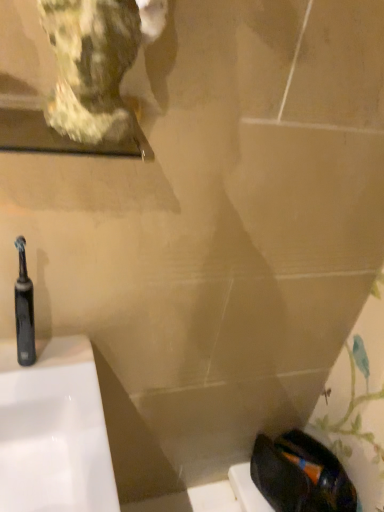
Image resolution: width=384 pixels, height=512 pixels. What do you see at coordinates (96, 62) in the screenshot?
I see `marble statue at upper left` at bounding box center [96, 62].

The height and width of the screenshot is (512, 384). In order to click on marble statue at upper left in this screenshot , I will do `click(96, 62)`.

The width and height of the screenshot is (384, 512). What do you see at coordinates (24, 310) in the screenshot?
I see `black rubber toothbrush at left` at bounding box center [24, 310].

This screenshot has height=512, width=384. Identify the location of black rubber toothbrush at left. (24, 310).

Measure the distance between black rubber toothbrush at left and camera.

24.82 inches.

I want to click on marble statue at upper left, so click(x=96, y=62).

Between marble statue at upper left and black rubber toothbrush at left, which one appears on the left side from the viewer's perspective?

black rubber toothbrush at left.

Who is more distant, marble statue at upper left or black rubber toothbrush at left?

black rubber toothbrush at left is further from the camera.

Between point (103, 98) and point (16, 286), which one is positioned behind?

Point (16, 286)

From the image's perspective, which one is positioned lower, marble statue at upper left or black rubber toothbrush at left?

black rubber toothbrush at left.

Based on the photo, from a real-world perspective, is marble statue at upper left physically located above or below black rubber toothbrush at left?

From a real-world perspective, marble statue at upper left is physically above black rubber toothbrush at left.

Considering the sizes of objects marble statue at upper left and black rubber toothbrush at left in the image provided, who is wider, marble statue at upper left or black rubber toothbrush at left?

With larger width is marble statue at upper left.

In terms of height, does marble statue at upper left look taller or shorter compared to black rubber toothbrush at left?

In the image, marble statue at upper left appears to be shorter than black rubber toothbrush at left.

Between marble statue at upper left and black rubber toothbrush at left, which one has larger size?

With larger size is marble statue at upper left.

Is marble statue at upper left not within black rubber toothbrush at left?

Yes, marble statue at upper left is not within black rubber toothbrush at left.

In the scene shown: Can you see marble statue at upper left touching black rubber toothbrush at left?

No, marble statue at upper left is not touching black rubber toothbrush at left.

Is marble statue at upper left turned away from black rubber toothbrush at left?

No, black rubber toothbrush at left is not at the back of marble statue at upper left.

How different are the orientations of marble statue at upper left and black rubber toothbrush at left in degrees?

marble statue at upper left and black rubber toothbrush at left are facing 49.1 degrees away from each other.

Locate an element on the screen. The width and height of the screenshot is (384, 512). toothbrush that appears behind the marble statue at upper left is located at coordinates (24, 310).

Considering the relative positions of black rubber toothbrush at left and marble statue at upper left in the image provided, is black rubber toothbrush at left to the left or to the right of marble statue at upper left?

From the image, it's evident that black rubber toothbrush at left is to the left of marble statue at upper left.

Relative to marble statue at upper left, is black rubber toothbrush at left in front or behind?

black rubber toothbrush at left is behind marble statue at upper left.

Considering the positions of point (17, 289) and point (94, 42), is point (17, 289) closer or farther from the camera than point (94, 42)?

Point (17, 289) is positioned farther from the camera compared to point (94, 42).

From the image's perspective, between black rubber toothbrush at left and marble statue at upper left, which one is located above?

marble statue at upper left is shown above in the image.

From a real-world perspective, is black rubber toothbrush at left located beneath marble statue at upper left?

Indeed, from a real-world perspective, black rubber toothbrush at left is positioned beneath marble statue at upper left.

Considering the relative sizes of black rubber toothbrush at left and marble statue at upper left in the image provided, is black rubber toothbrush at left wider than marble statue at upper left?

No, black rubber toothbrush at left is not wider than marble statue at upper left.

Can you confirm if black rubber toothbrush at left is shorter than marble statue at upper left?

No, black rubber toothbrush at left is not shorter than marble statue at upper left.

Can you confirm if black rubber toothbrush at left is smaller than marble statue at upper left?

Indeed, black rubber toothbrush at left has a smaller size compared to marble statue at upper left.

Would you say black rubber toothbrush at left is outside marble statue at upper left?

Yes, black rubber toothbrush at left is located beyond the bounds of marble statue at upper left.

Is black rubber toothbrush at left not near marble statue at upper left?

black rubber toothbrush at left is actually quite close to marble statue at upper left.

Based on the photo, is black rubber toothbrush at left oriented towards marble statue at upper left?

No, black rubber toothbrush at left does not turn towards marble statue at upper left.

What's the angular difference between black rubber toothbrush at left and marble statue at upper left's facing directions?

The angular difference between black rubber toothbrush at left and marble statue at upper left is 49.1 degrees.

Identify the location of toothbrush located behind the marble statue at upper left. (24, 310).

The width and height of the screenshot is (384, 512). Identify the location of sculpture above the black rubber toothbrush at left (from a real-world perspective). (96, 62).

Find the location of a particular element. sculpture on the right of black rubber toothbrush at left is located at coordinates pos(96,62).